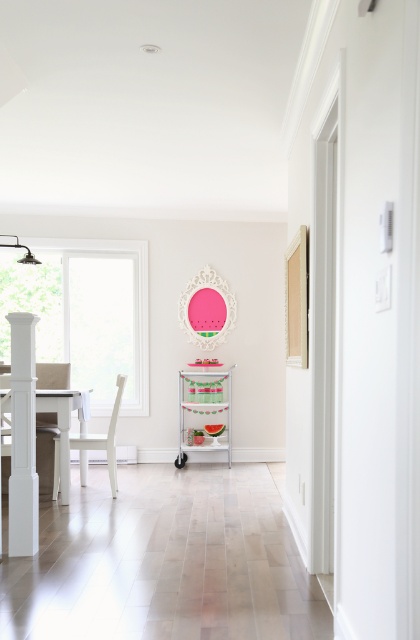
Does white glossy table at left have a lesser height compared to white matte chair at left?

Yes, white glossy table at left is shorter than white matte chair at left.

What do you see at coordinates (62, 426) in the screenshot?
I see `white glossy table at left` at bounding box center [62, 426].

Image resolution: width=420 pixels, height=640 pixels. I want to click on white glossy table at left, so click(x=62, y=426).